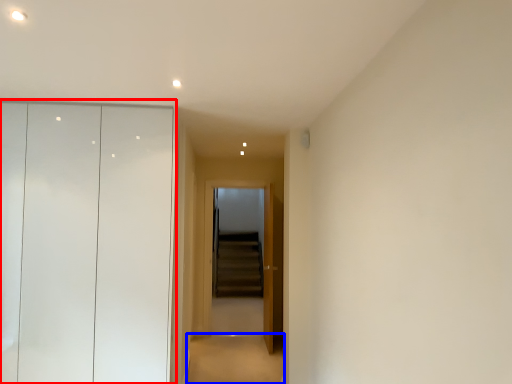
Question: Among these objects, which one is nearest to the camera, dresser (highlighted by a red box) or path (highlighted by a blue box)?

Choices:
 (A) dresser
 (B) path

Answer: (A)